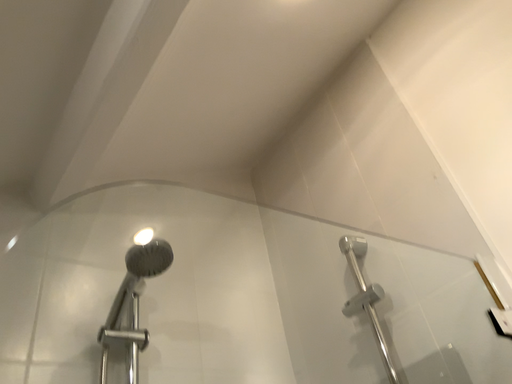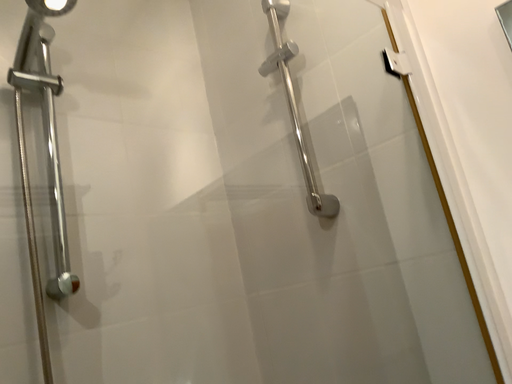
Question: How did the camera likely rotate when shooting the video?

Choices:
 (A) rotated right
 (B) rotated left

Answer: (A)